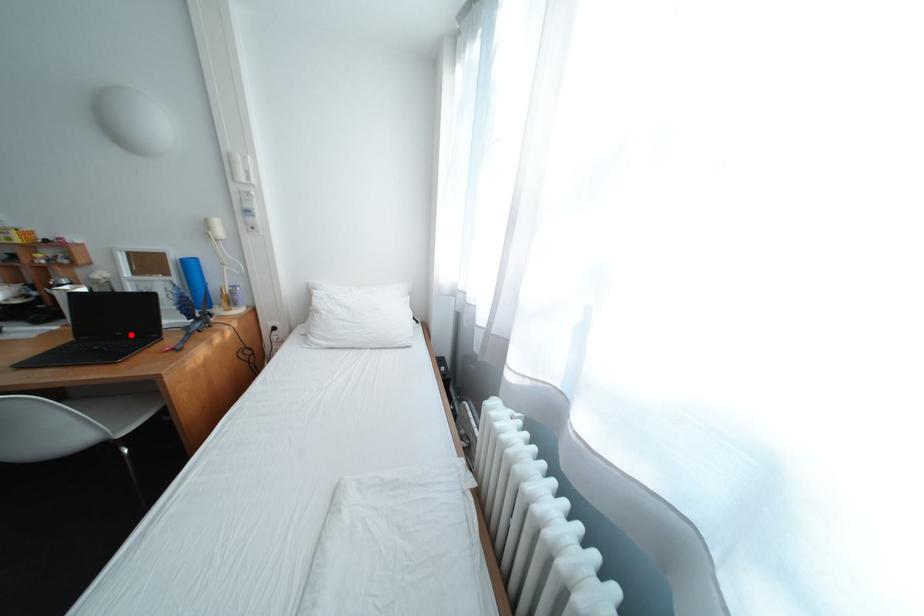
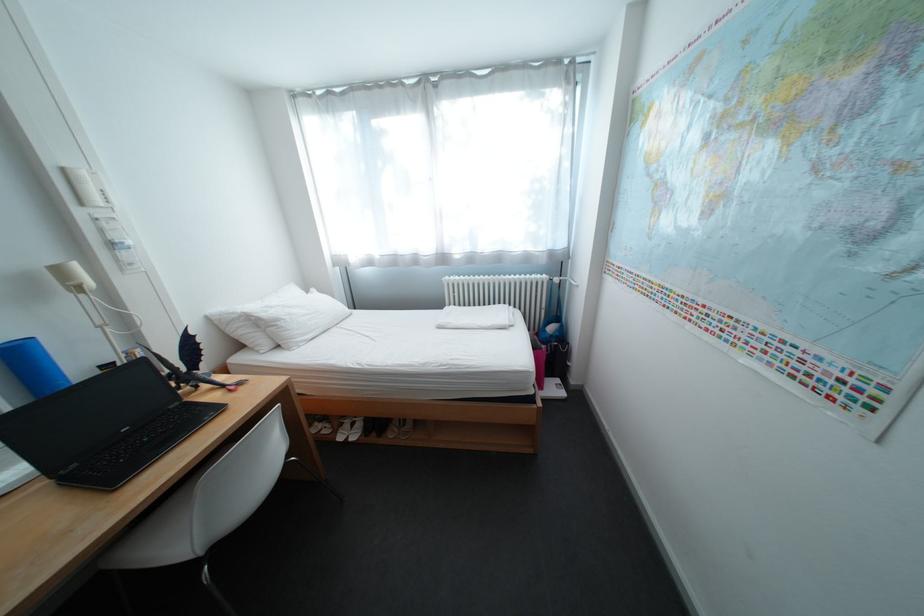
Question: I am providing you with two images of the same scene from different viewpoints. A red point is marked on the first image. Can you still see the location of the red point in image 2?

Choices:
 (A) Yes
 (B) No

Answer: (A)